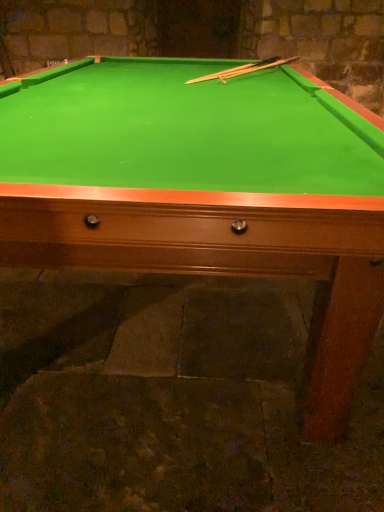
Describe the element at coordinates (232, 70) in the screenshot. I see `wooden cue at upper center` at that location.

The image size is (384, 512). I want to click on wooden cue at upper center, so click(232, 70).

At what (x,y) coordinates should I click in order to perform the action: click on wooden cue at upper center. Please return your answer as a coordinate pair (x, y). Image resolution: width=384 pixels, height=512 pixels. Looking at the image, I should click on (232, 70).